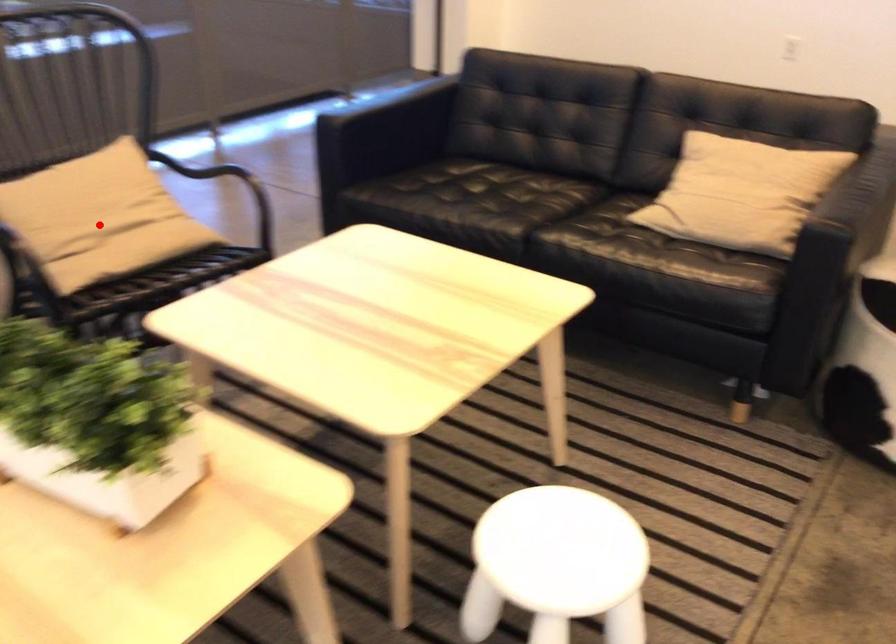
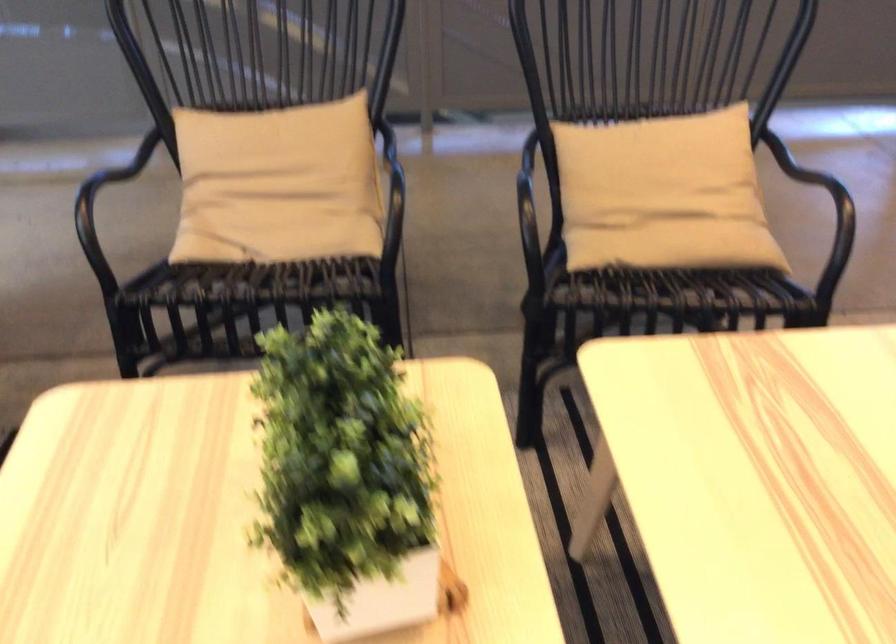
The point at the highlighted location is marked in the first image. Where is the corresponding point in the second image?

(662, 194)